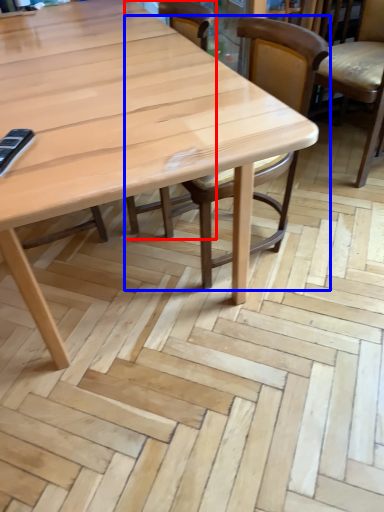
Question: Which object appears farthest to the camera in this image, chair (highlighted by a red box) or chair (highlighted by a blue box)?

Choices:
 (A) chair
 (B) chair

Answer: (A)